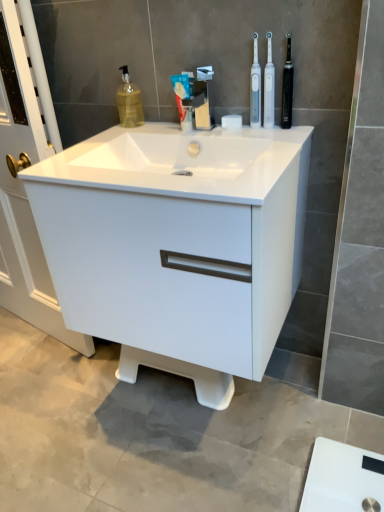
Question: Can you confirm if black rubber toothbrush at upper right is bigger than translucent yellow liquid at upper left?

Choices:
 (A) yes
 (B) no

Answer: (B)

Question: Can you confirm if black rubber toothbrush at upper right is positioned to the left of translucent yellow liquid at upper left?

Choices:
 (A) no
 (B) yes

Answer: (A)

Question: From a real-world perspective, is black rubber toothbrush at upper right physically above translucent yellow liquid at upper left?

Choices:
 (A) yes
 (B) no

Answer: (A)

Question: Is black rubber toothbrush at upper right far away from translucent yellow liquid at upper left?

Choices:
 (A) yes
 (B) no

Answer: (B)

Question: Considering the relative positions of black rubber toothbrush at upper right and translucent yellow liquid at upper left in the image provided, is black rubber toothbrush at upper right in front of translucent yellow liquid at upper left?

Choices:
 (A) yes
 (B) no

Answer: (A)

Question: From the image's perspective, does black rubber toothbrush at upper right appear higher than translucent yellow liquid at upper left?

Choices:
 (A) no
 (B) yes

Answer: (A)

Question: Is white glossy sink at center at the right side of white plastic toothbrush at upper right, placed as the first toothbrush when sorted from left to right?

Choices:
 (A) no
 (B) yes

Answer: (A)

Question: Considering the relative sizes of white glossy sink at center and white plastic toothbrush at upper right, placed as the first toothbrush when sorted from left to right, in the image provided, is white glossy sink at center shorter than white plastic toothbrush at upper right, placed as the first toothbrush when sorted from left to right,?

Choices:
 (A) no
 (B) yes

Answer: (B)

Question: Is white glossy sink at center closer to camera compared to white plastic toothbrush at upper right, the second toothbrush positioned from the right?

Choices:
 (A) yes
 (B) no

Answer: (A)

Question: Is white plastic toothbrush at upper right, the second toothbrush positioned from the right, at the back of white glossy sink at center?

Choices:
 (A) yes
 (B) no

Answer: (B)

Question: Is white glossy sink at center bigger than white plastic toothbrush at upper right, placed as the first toothbrush when sorted from left to right?

Choices:
 (A) yes
 (B) no

Answer: (A)

Question: From a real-world perspective, is white glossy sink at center on top of white plastic toothbrush at upper right, placed as the first toothbrush when sorted from left to right?

Choices:
 (A) yes
 (B) no

Answer: (B)

Question: Is white matte toothpaste at center at the right side of white plastic toothbrush at upper right, which is the 2th toothbrush in left-to-right order?

Choices:
 (A) yes
 (B) no

Answer: (B)